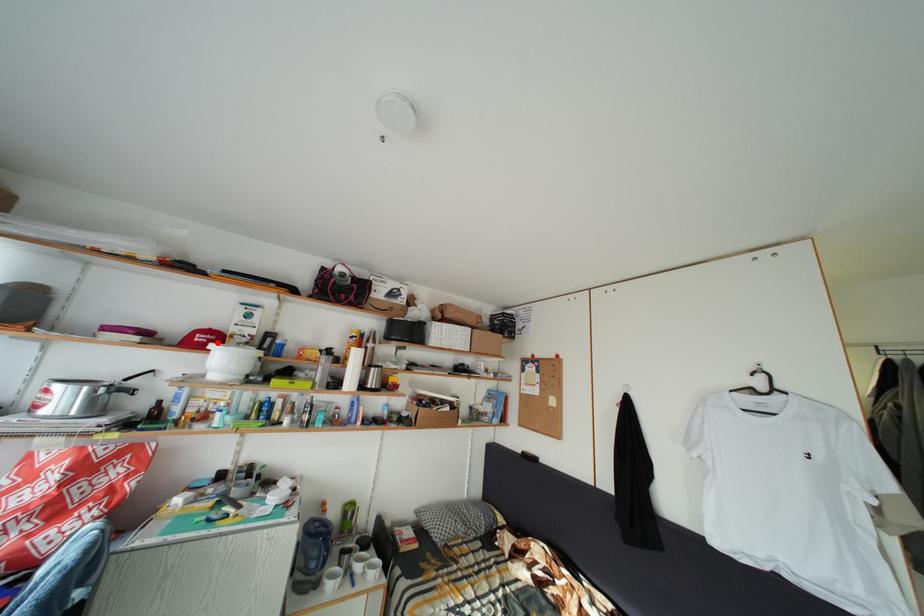
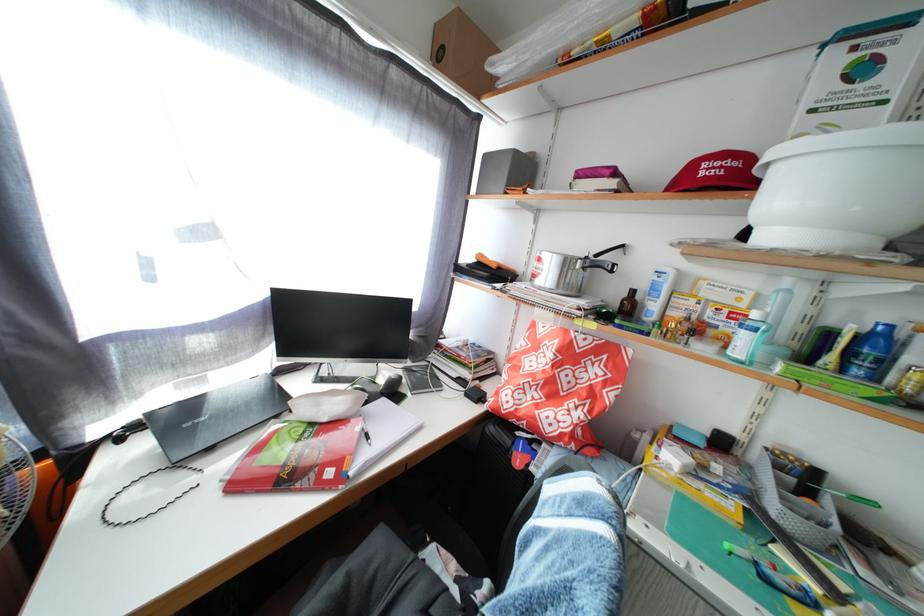
Question: I am providing you with two images of the same scene from different viewpoints. A red point is marked on the first image. Is the red point's position out of view in image 2?

Choices:
 (A) Yes
 (B) No

Answer: (B)